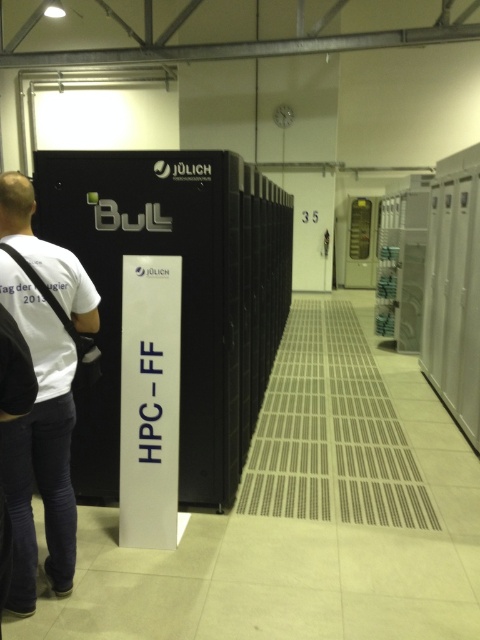
Question: Which object appears closest to the camera in this image?

Choices:
 (A) white t-shirt at left
 (B) black metal server at center

Answer: (A)

Question: Where is black metal server at center located in relation to white t-shirt at left in the image?

Choices:
 (A) right
 (B) left

Answer: (A)

Question: Which object is closer to the camera taking this photo?

Choices:
 (A) white t-shirt at left
 (B) black metal server at center

Answer: (A)

Question: Which point appears closest to the camera in this image?

Choices:
 (A) (193, 180)
 (B) (70, 513)

Answer: (B)

Question: Does black metal server at center appear on the left side of white t-shirt at left?

Choices:
 (A) no
 (B) yes

Answer: (A)

Question: Is black metal server at center to the right of white t-shirt at left from the viewer's perspective?

Choices:
 (A) no
 (B) yes

Answer: (B)